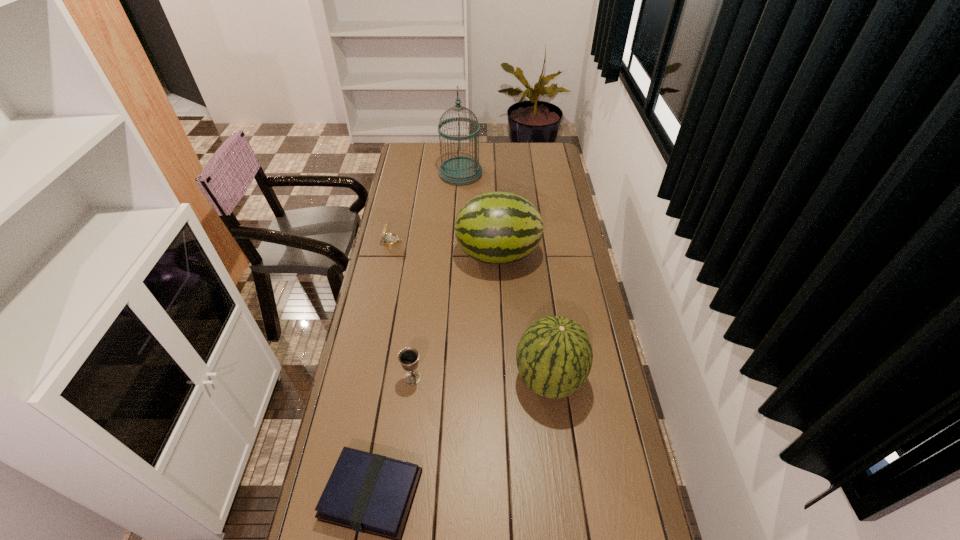
Find the location of a particular element. Image resolution: width=960 pixels, height=540 pixels. birdcage is located at coordinates (460, 170).

Where is `the farthest object`? This screenshot has height=540, width=960. the farthest object is located at coordinates (460, 170).

Locate an element on the screen. The image size is (960, 540). the farther watermelon is located at coordinates (495, 227).

Where is `the nearer watermelon`? This screenshot has width=960, height=540. the nearer watermelon is located at coordinates (554, 356).

The image size is (960, 540). What are the coordinates of `the fourth tallest object` in the screenshot? It's located at (408, 357).

The image size is (960, 540). In order to click on compass in this screenshot , I will do `click(390, 239)`.

At what (x,y) coordinates should I click in order to perform the action: click on free region located on the front-facing side of the tallest object. Please return your answer as a coordinate pair (x, y). The width and height of the screenshot is (960, 540). Looking at the image, I should click on (533, 173).

Where is `vacant space located 0.160m at the stem end of the farther watermelon`? The width and height of the screenshot is (960, 540). vacant space located 0.160m at the stem end of the farther watermelon is located at coordinates (418, 254).

You are a GUI agent. You are given a task and a screenshot of the screen. Output one action in this format:
    pyautogui.click(x=<x>, y=<y>)
    Task: Click on the vacant space located 0.300m at the stem end of the farther watermelon
    
    Given the screenshot: What is the action you would take?
    pyautogui.click(x=384, y=254)

Locate an element on the screen. The height and width of the screenshot is (540, 960). vacant space located 0.110m at the stem end of the farther watermelon is located at coordinates (429, 254).